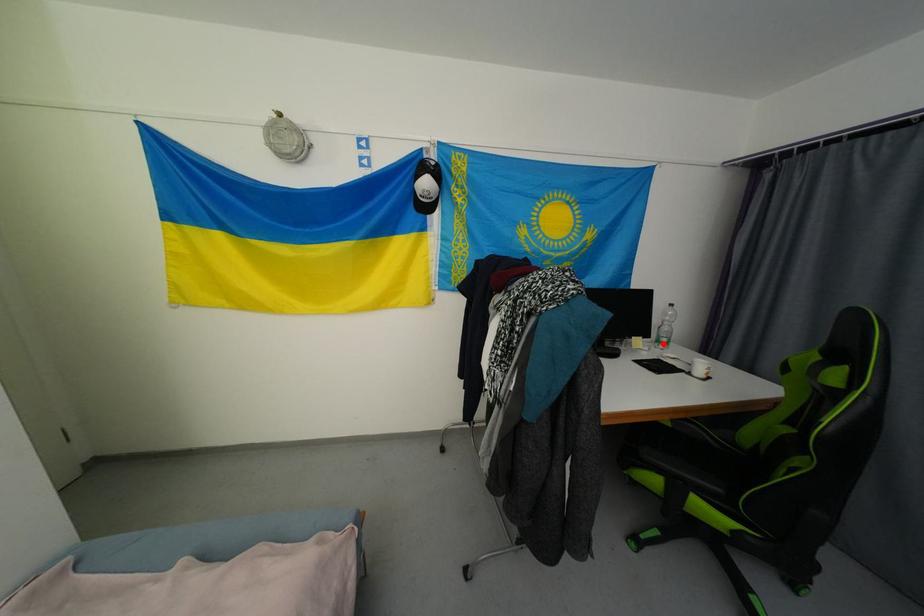
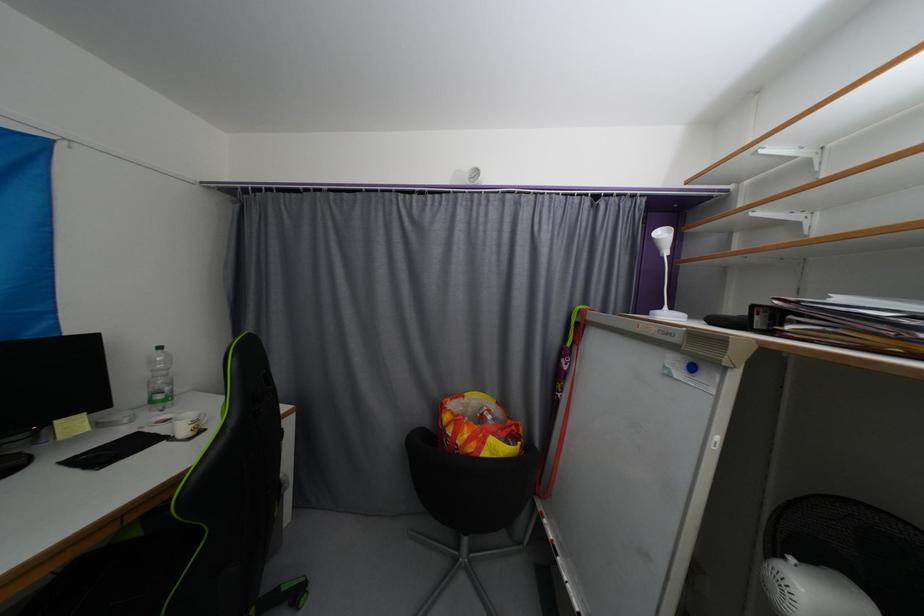
Find the pixel in the second image that matches the highlighted location in the first image.

(157, 403)